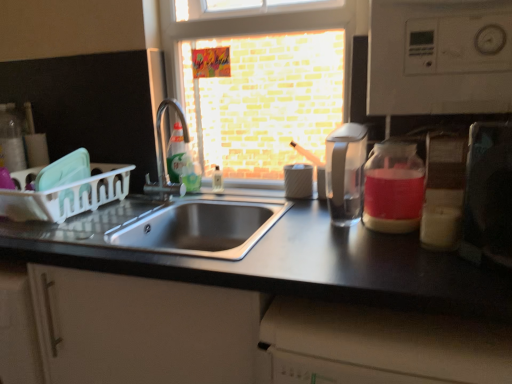
This screenshot has height=384, width=512. In order to click on spots to the right of translucent green liquid at sink left, the 1th bottle in the right-to-left sequence in this screenshot , I will do `click(227, 192)`.